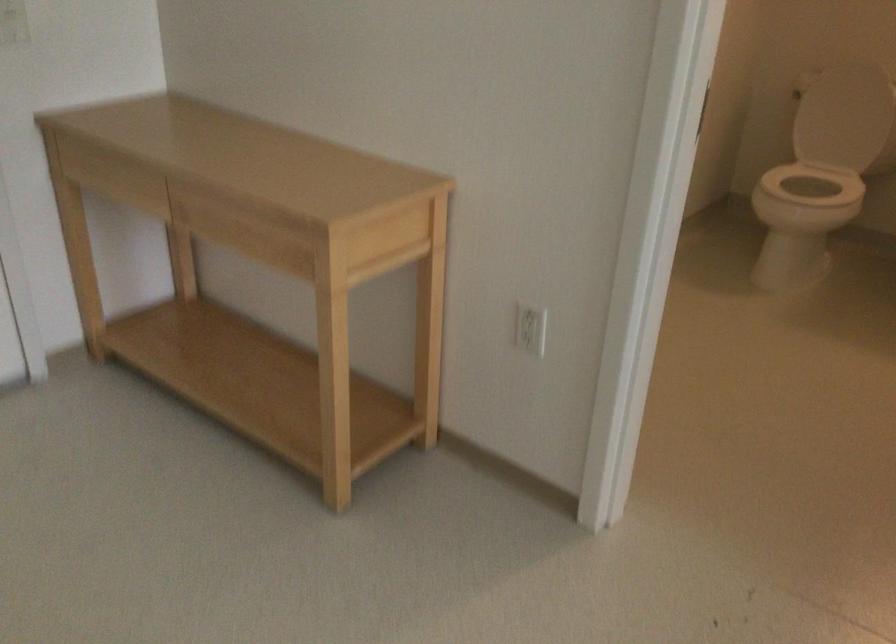
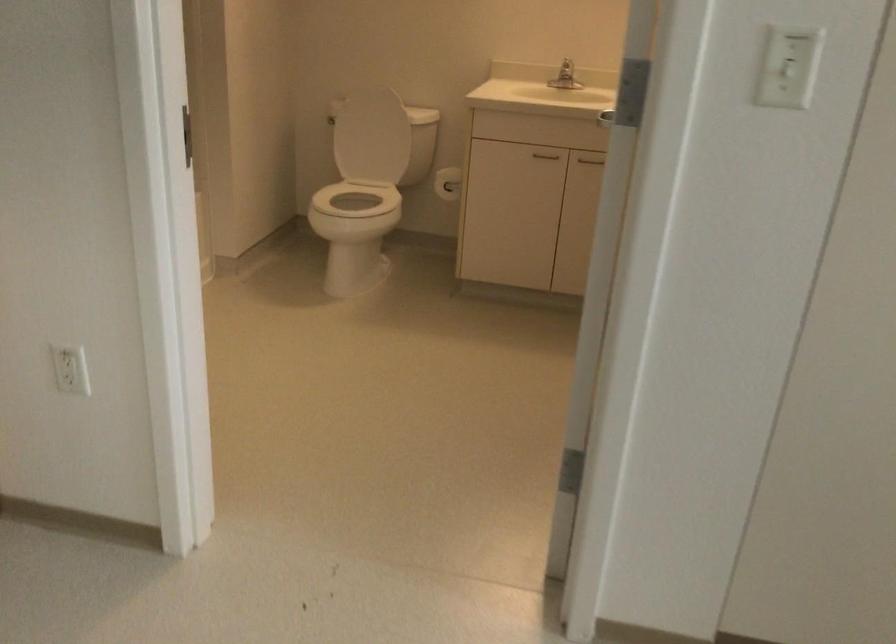
Question: Based on the continuous images, in which direction is the camera rotating? Reply with the corresponding letter.

Choices:
 (A) Left
 (B) Right
 (C) Up
 (D) Down

Answer: (B)